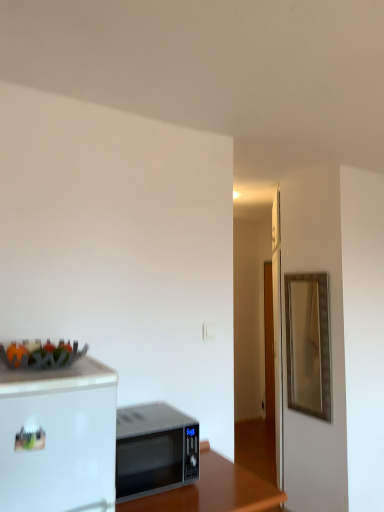
Question: Does silver metallic microwave at center lie behind metallic fruit basket at upper left?

Choices:
 (A) yes
 (B) no

Answer: (A)

Question: Is silver metallic microwave at center positioned with its back to metallic fruit basket at upper left?

Choices:
 (A) no
 (B) yes

Answer: (A)

Question: From the image's perspective, is silver metallic microwave at center under metallic fruit basket at upper left?

Choices:
 (A) no
 (B) yes

Answer: (B)

Question: Does silver metallic microwave at center have a larger size compared to metallic fruit basket at upper left?

Choices:
 (A) no
 (B) yes

Answer: (B)

Question: From a real-world perspective, does silver metallic microwave at center sit lower than metallic fruit basket at upper left?

Choices:
 (A) yes
 (B) no

Answer: (A)

Question: From a real-world perspective, does silver metallic microwave at center stand above metallic fruit basket at upper left?

Choices:
 (A) no
 (B) yes

Answer: (A)

Question: Can you confirm if silver metallic microwave at center is shorter than black glossy microwave at lower center?

Choices:
 (A) no
 (B) yes

Answer: (B)

Question: From the image's perspective, is silver metallic microwave at center located beneath black glossy microwave at lower center?

Choices:
 (A) yes
 (B) no

Answer: (B)

Question: From a real-world perspective, does silver metallic microwave at center stand above black glossy microwave at lower center?

Choices:
 (A) yes
 (B) no

Answer: (A)

Question: Is silver metallic microwave at center positioned with its back to black glossy microwave at lower center?

Choices:
 (A) yes
 (B) no

Answer: (B)

Question: Is silver metallic microwave at center far away from black glossy microwave at lower center?

Choices:
 (A) yes
 (B) no

Answer: (B)

Question: Could you tell me if silver metallic microwave at center is facing black glossy microwave at lower center?

Choices:
 (A) yes
 (B) no

Answer: (B)

Question: Would you consider gold metallic mirror at right to be distant from silver metallic microwave at center?

Choices:
 (A) yes
 (B) no

Answer: (A)